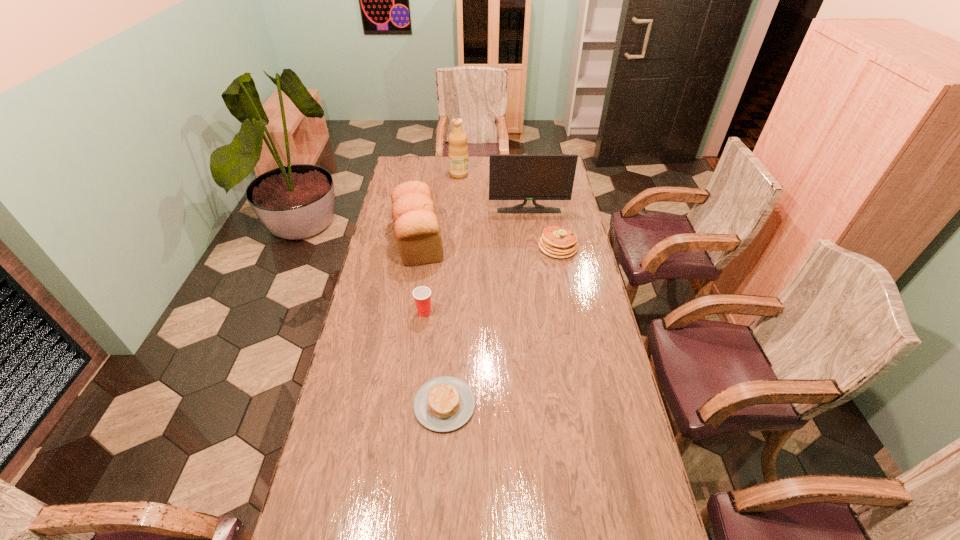
The image size is (960, 540). Find the location of `vacant space at the left edge of the desktop`. vacant space at the left edge of the desktop is located at coordinates (397, 294).

Where is `vacant area at the right edge`? vacant area at the right edge is located at coordinates (583, 245).

Where is `vacant region between the second shortest object and the bread`? vacant region between the second shortest object and the bread is located at coordinates 489,243.

Find the location of a particular element. The image size is (960, 540). vacant space that's between the monitor and the shortest object is located at coordinates (487, 307).

Locate an element on the screen. The image size is (960, 540). vacant area that lies between the bread and the nearest object is located at coordinates (432, 322).

Where is `blank region between the fifth tallest object and the shorter pancake`? blank region between the fifth tallest object and the shorter pancake is located at coordinates (501, 326).

What are the coordinates of `unoccupied position between the bread and the fifth farthest object` in the screenshot? It's located at (421, 276).

Image resolution: width=960 pixels, height=540 pixels. What are the coordinates of `unoccupied position between the bread and the olive oil` in the screenshot? It's located at (439, 207).

The width and height of the screenshot is (960, 540). I want to click on the fifth closest object to the shorter pancake, so click(x=458, y=150).

Where is `the third closest object to the shorter pancake`? The height and width of the screenshot is (540, 960). the third closest object to the shorter pancake is located at coordinates (557, 242).